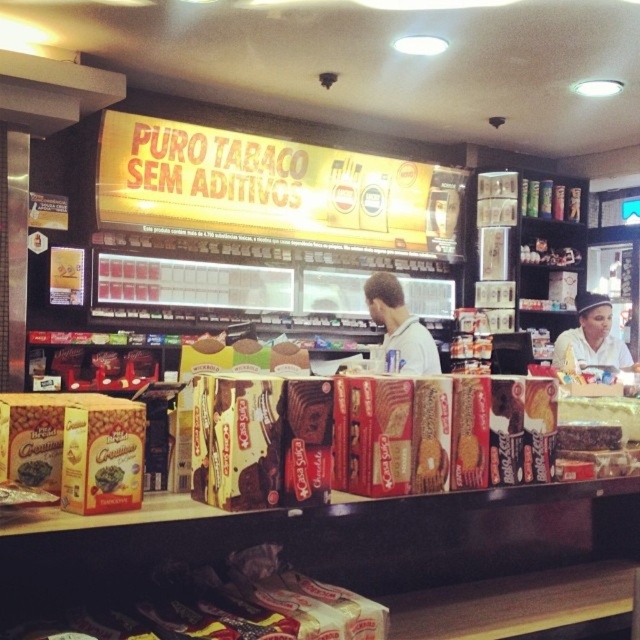
Question: Can you confirm if brown matte cookie at center is thinner than shiny chocolate bar at center?

Choices:
 (A) yes
 (B) no

Answer: (B)

Question: Which object appears closest to the camera in this image?

Choices:
 (A) white uniform at right
 (B) gray fabric shirt at center
 (C) shiny chocolate bar at center
 (D) white cardboard box at lower center

Answer: (D)

Question: Can you confirm if white uniform at right is smaller than brown matte cookie at center?

Choices:
 (A) yes
 (B) no

Answer: (B)

Question: Among these points, which one is farthest from the camera?

Choices:
 (A) (394, 342)
 (B) (113, 467)
 (C) (589, 298)

Answer: (C)

Question: Does white cardboard box at lower center appear over gray fabric shirt at center?

Choices:
 (A) no
 (B) yes

Answer: (A)

Question: Which of the following is the closest to the observer?

Choices:
 (A) (609, 317)
 (B) (202, 595)
 (C) (22, 474)
 (D) (122, 468)

Answer: (D)